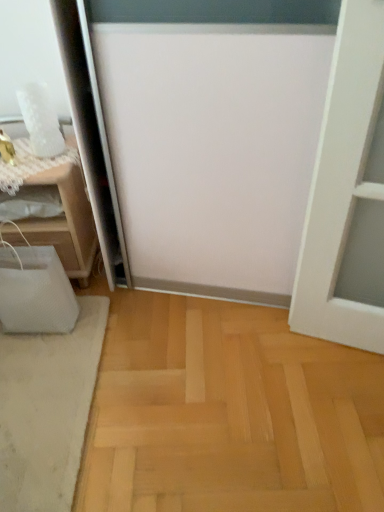
Question: From the image's perspective, is white soft rug at lower left located beneath white mesh bag at left?

Choices:
 (A) yes
 (B) no

Answer: (A)

Question: From the image's perspective, is white soft rug at lower left on top of white mesh bag at left?

Choices:
 (A) yes
 (B) no

Answer: (B)

Question: Can you confirm if white soft rug at lower left is shorter than white mesh bag at left?

Choices:
 (A) yes
 (B) no

Answer: (A)

Question: Is white soft rug at lower left smaller than white mesh bag at left?

Choices:
 (A) no
 (B) yes

Answer: (B)

Question: Does white soft rug at lower left have a greater width compared to white mesh bag at left?

Choices:
 (A) no
 (B) yes

Answer: (B)

Question: Can white mesh bag at left be found inside white soft rug at lower left?

Choices:
 (A) no
 (B) yes

Answer: (A)

Question: From a real-world perspective, does white mesh bag at left sit lower than white soft rug at lower left?

Choices:
 (A) yes
 (B) no

Answer: (B)

Question: Considering the relative positions of white mesh bag at left and white soft rug at lower left in the image provided, is white mesh bag at left to the right of white soft rug at lower left from the viewer's perspective?

Choices:
 (A) yes
 (B) no

Answer: (B)

Question: Considering the relative sizes of white mesh bag at left and white soft rug at lower left in the image provided, is white mesh bag at left shorter than white soft rug at lower left?

Choices:
 (A) no
 (B) yes

Answer: (A)

Question: Is white mesh bag at left next to white soft rug at lower left and touching it?

Choices:
 (A) yes
 (B) no

Answer: (B)

Question: Can you confirm if white mesh bag at left is bigger than white soft rug at lower left?

Choices:
 (A) no
 (B) yes

Answer: (B)

Question: Considering the relative sizes of white mesh bag at left and white soft rug at lower left in the image provided, is white mesh bag at left wider than white soft rug at lower left?

Choices:
 (A) no
 (B) yes

Answer: (A)

Question: Does point (13, 429) appear closer or farther from the camera than point (49, 224)?

Choices:
 (A) closer
 (B) farther

Answer: (A)